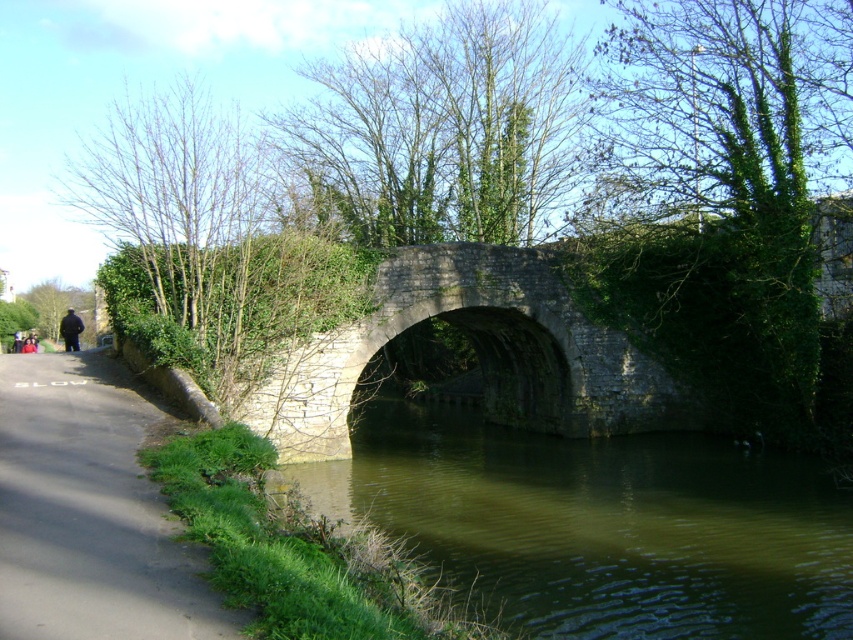
Question: Does gray asphalt road at lower left have a larger size compared to dark gray fabric jacket at left?

Choices:
 (A) no
 (B) yes

Answer: (A)

Question: Observing the image, what is the correct spatial positioning of greenish murky water at center in reference to dark gray fabric jacket at left?

Choices:
 (A) right
 (B) left

Answer: (A)

Question: Which of the following is the farthest from the observer?

Choices:
 (A) (689, 502)
 (B) (380, 296)
 (C) (78, 348)

Answer: (C)

Question: Which of the following is the closest to the observer?

Choices:
 (A) (485, 337)
 (B) (39, 420)

Answer: (B)

Question: Which of the following is the closest to the observer?

Choices:
 (A) (76, 316)
 (B) (177, 563)
 (C) (311, 372)

Answer: (B)

Question: Is greenish murky water at center below gray stone bridge at center?

Choices:
 (A) no
 (B) yes

Answer: (B)